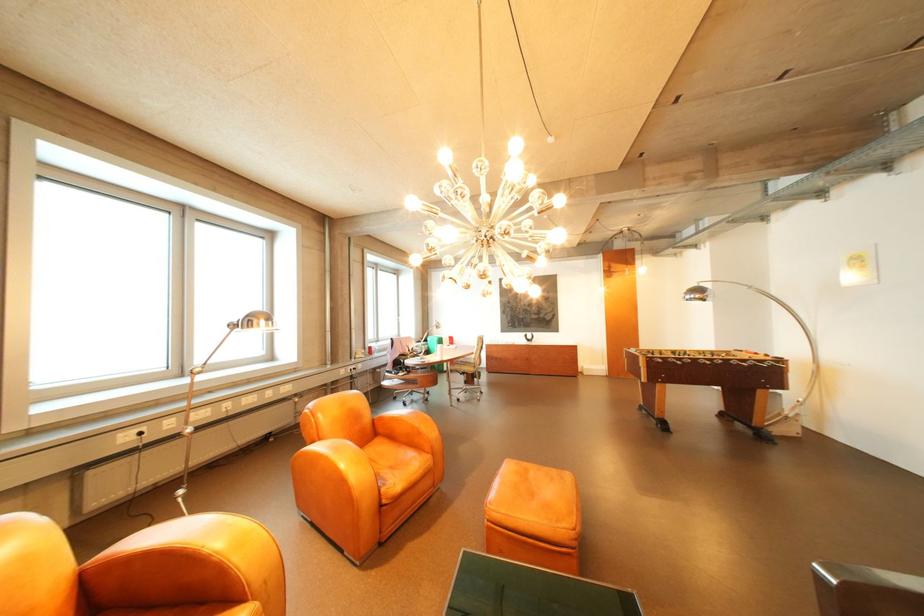
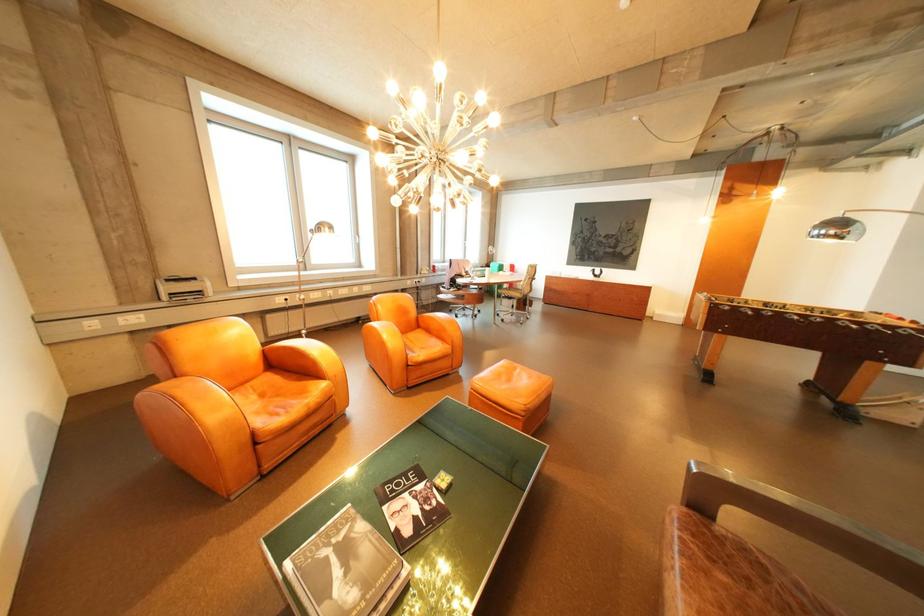
The images are taken continuously from a first-person perspective. In which direction are you moving?

The cameraman moved toward right, backward.